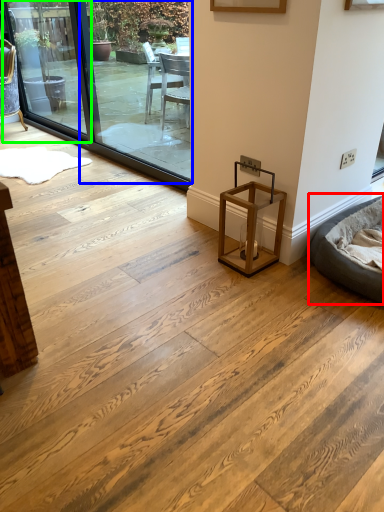
Question: Based on their relative distances, which object is farther from bean bag chair (highlighted by a red box)? Choose from window screen (highlighted by a blue box) and window screen (highlighted by a green box).

Choices:
 (A) window screen
 (B) window screen

Answer: (B)